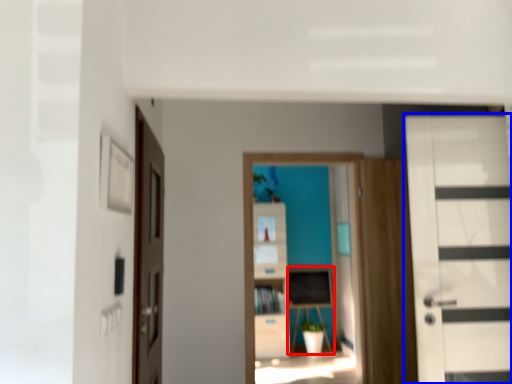
Question: Which of the following is the closest to the observer, table (highlighted by a red box) or door (highlighted by a blue box)?

Choices:
 (A) table
 (B) door

Answer: (B)